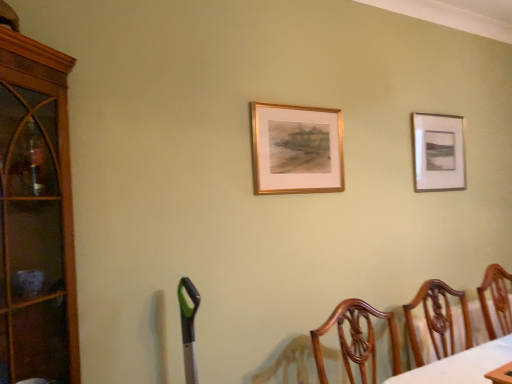
The height and width of the screenshot is (384, 512). Find the location of `matte silver picture frame at upper right, the 1th picture frame from the back`. matte silver picture frame at upper right, the 1th picture frame from the back is located at coordinates (438, 152).

Measure the distance between point (447, 119) and camera.

Point (447, 119) and camera are 2.62 meters apart from each other.

This screenshot has width=512, height=384. Describe the element at coordinates (36, 214) in the screenshot. I see `brown wood cabinet at left` at that location.

You are a GUI agent. You are given a task and a screenshot of the screen. Output one action in this format:
    pyautogui.click(x=<x>, y=<y>)
    Task: Click on the wooden chair at lower right
    This screenshot has width=512, height=384.
    Given the screenshot: What is the action you would take?
    pyautogui.click(x=496, y=299)

What are the coordinates of `gold metallic picture frame at center, which ranks as the first picture frame in left-to-right order` in the screenshot? It's located at (296, 149).

Which is less distant, (10,142) or (419,135)?

The point (10,142) is closer to the camera.

Is brown wood cabinet at left bigger than matte silver picture frame at upper right, the 1th picture frame from the back?

Correct, brown wood cabinet at left is larger in size than matte silver picture frame at upper right, the 1th picture frame from the back.

Is brown wood cabinet at left oriented towards matte silver picture frame at upper right, arranged as the second picture frame when viewed from the front?

No, brown wood cabinet at left does not turn towards matte silver picture frame at upper right, arranged as the second picture frame when viewed from the front.

Does brown wood cabinet at left appear on the right side of matte silver picture frame at upper right, the first picture frame when ordered from right to left?

No, brown wood cabinet at left is not to the right of matte silver picture frame at upper right, the first picture frame when ordered from right to left.

How far apart are gold metallic picture frame at center, the first picture frame positioned from the front, and wooden chair at lower right?

A distance of 1.18 meters exists between gold metallic picture frame at center, the first picture frame positioned from the front, and wooden chair at lower right.

Is wooden chair at lower right surrounded by gold metallic picture frame at center, which is the second picture frame in right-to-left order?

That's incorrect, wooden chair at lower right is not inside gold metallic picture frame at center, which is the second picture frame in right-to-left order.

Between gold metallic picture frame at center, the 2th picture frame positioned from the back, and wooden chair at lower right, which one is positioned in front?

gold metallic picture frame at center, the 2th picture frame positioned from the back, is in front.

Consider the image. Who is bigger, gold metallic picture frame at center, which is the second picture frame in right-to-left order, or wooden chair at lower right?

wooden chair at lower right is bigger.

Is matte silver picture frame at upper right, the first picture frame when ordered from right to left, thinner than gold metallic picture frame at center, which ranks as the first picture frame in left-to-right order?

No.

Between matte silver picture frame at upper right, the 1th picture frame from the back, and gold metallic picture frame at center, the 2th picture frame positioned from the back, which one appears on the left side from the viewer's perspective?

gold metallic picture frame at center, the 2th picture frame positioned from the back, is more to the left.

Is matte silver picture frame at upper right, the 1th picture frame from the back, positioned beyond the bounds of gold metallic picture frame at center, which ranks as the first picture frame in left-to-right order?

matte silver picture frame at upper right, the 1th picture frame from the back, lies outside gold metallic picture frame at center, which ranks as the first picture frame in left-to-right order,'s area.

Which point is more distant from viewer, (432, 126) or (253, 112)?

The point (432, 126) is farther.

Is point (504, 285) farther from viewer compared to point (434, 178)?

That is False.

From the image's perspective, is wooden chair at lower right located above matte silver picture frame at upper right, the first picture frame when ordered from right to left?

Actually, wooden chair at lower right appears below matte silver picture frame at upper right, the first picture frame when ordered from right to left, in the image.

Looking at this image, which of these two, wooden chair at lower right or matte silver picture frame at upper right, positioned as the second picture frame in left-to-right order, is thinner?

Thinner between the two is matte silver picture frame at upper right, positioned as the second picture frame in left-to-right order.

Who is shorter, wooden chair at lower right or matte silver picture frame at upper right, the 1th picture frame from the back?

wooden chair at lower right.

Can you confirm if gold metallic picture frame at center, the 2th picture frame positioned from the back, is smaller than brown wood cabinet at left?

Yes.

Find the location of a particular element. The width and height of the screenshot is (512, 384). picture frame that is the 1st one above the brown wood cabinet at left (from a real-world perspective) is located at coordinates (296, 149).

Does brown wood cabinet at left turn towards wooden chair at lower right?

No.

Looking at this image, from the image's perspective, between brown wood cabinet at left and wooden chair at lower right, who is located below?

wooden chair at lower right, from the image's perspective.

Based on the photo, from a real-world perspective, is brown wood cabinet at left physically below wooden chair at lower right?

Actually, brown wood cabinet at left is physically above wooden chair at lower right in the real world.

Looking at this image, considering the sizes of objects brown wood cabinet at left and wooden chair at lower right in the image provided, who is wider, brown wood cabinet at left or wooden chair at lower right?

brown wood cabinet at left is wider.

Is gold metallic picture frame at center, the 2th picture frame positioned from the back, facing away from matte silver picture frame at upper right, arranged as the second picture frame when viewed from the front?

No, gold metallic picture frame at center, the 2th picture frame positioned from the back,'s orientation is not away from matte silver picture frame at upper right, arranged as the second picture frame when viewed from the front.

Based on the photo, from the image's perspective, relative to matte silver picture frame at upper right, the 1th picture frame from the back, is gold metallic picture frame at center, which ranks as the first picture frame in left-to-right order, above or below?

gold metallic picture frame at center, which ranks as the first picture frame in left-to-right order, is below matte silver picture frame at upper right, the 1th picture frame from the back.

In the scene shown: Which is closer to the camera, (257, 115) or (425, 142)?

Point (257, 115).

In the scene shown: Is gold metallic picture frame at center, the first picture frame positioned from the front, far from matte silver picture frame at upper right, arranged as the second picture frame when viewed from the front?

No, there isn't a large distance between gold metallic picture frame at center, the first picture frame positioned from the front, and matte silver picture frame at upper right, arranged as the second picture frame when viewed from the front.

From a real-world perspective, which picture frame is the 2nd one above the brown wood cabinet at left? Please provide its 2D coordinates.

[(438, 152)]

The width and height of the screenshot is (512, 384). In order to click on picture frame in front of the wooden chair at lower right in this screenshot , I will do `click(296, 149)`.

Considering their positions, is matte silver picture frame at upper right, the first picture frame when ordered from right to left, positioned closer to wooden chair at lower right than gold metallic picture frame at center, the first picture frame positioned from the front?

Among the two, matte silver picture frame at upper right, the first picture frame when ordered from right to left, is located nearer to wooden chair at lower right.

Estimate the real-world distances between objects in this image. Which object is closer to matte silver picture frame at upper right, positioned as the second picture frame in left-to-right order, brown wood cabinet at left or wooden chair at lower right?

wooden chair at lower right lies closer to matte silver picture frame at upper right, positioned as the second picture frame in left-to-right order, than the other object.

Consider the image. Which object lies further to the anchor point matte silver picture frame at upper right, arranged as the second picture frame when viewed from the front, gold metallic picture frame at center, which ranks as the first picture frame in left-to-right order, or brown wood cabinet at left?

brown wood cabinet at left.

Considering their positions, is brown wood cabinet at left positioned further to matte silver picture frame at upper right, positioned as the second picture frame in left-to-right order, than gold metallic picture frame at center, which ranks as the first picture frame in left-to-right order?

brown wood cabinet at left is further to matte silver picture frame at upper right, positioned as the second picture frame in left-to-right order.

Looking at the image, which one is located further to wooden chair at lower right, matte silver picture frame at upper right, positioned as the second picture frame in left-to-right order, or brown wood cabinet at left?

Based on the image, brown wood cabinet at left appears to be further to wooden chair at lower right.

Considering their positions, is gold metallic picture frame at center, which is the second picture frame in right-to-left order, positioned closer to brown wood cabinet at left than wooden chair at lower right?

Among the two, gold metallic picture frame at center, which is the second picture frame in right-to-left order, is located nearer to brown wood cabinet at left.

Considering their positions, is gold metallic picture frame at center, the 2th picture frame positioned from the back, positioned closer to matte silver picture frame at upper right, arranged as the second picture frame when viewed from the front, than wooden chair at lower right?

Among the two, wooden chair at lower right is located nearer to matte silver picture frame at upper right, arranged as the second picture frame when viewed from the front.

When comparing their distances from wooden chair at lower right, does gold metallic picture frame at center, the 2th picture frame positioned from the back, or brown wood cabinet at left seem closer?

gold metallic picture frame at center, the 2th picture frame positioned from the back, is positioned closer to the anchor wooden chair at lower right.

At what (x,y) coordinates should I click in order to perform the action: click on picture frame situated between brown wood cabinet at left and matte silver picture frame at upper right, the first picture frame when ordered from right to left, from left to right. Please return your answer as a coordinate pair (x, y). The height and width of the screenshot is (384, 512). Looking at the image, I should click on (296, 149).

Where is `picture frame between gold metallic picture frame at center, the 2th picture frame positioned from the back, and wooden chair at lower right, in the horizontal direction`? picture frame between gold metallic picture frame at center, the 2th picture frame positioned from the back, and wooden chair at lower right, in the horizontal direction is located at coordinates (438, 152).